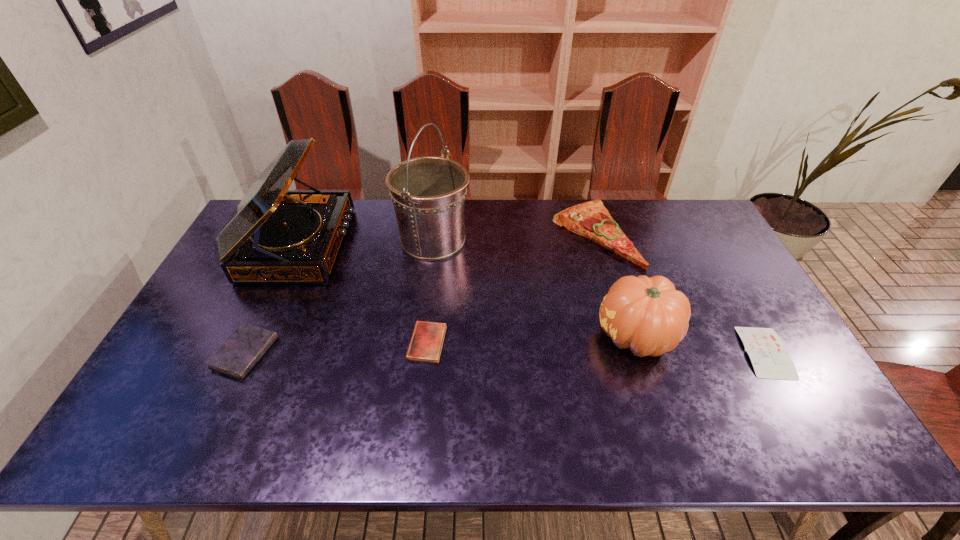
Where is `blank space at the far right corner of the desktop`? blank space at the far right corner of the desktop is located at coordinates (681, 219).

The image size is (960, 540). In order to click on free spot between the third shortest object and the pizza in this screenshot , I will do `click(420, 293)`.

You are a GUI agent. You are given a task and a screenshot of the screen. Output one action in this format:
    pyautogui.click(x=<x>, y=<y>)
    Task: Click on the vacant region between the pumpkin and the sixth tallest object
    
    Given the screenshot: What is the action you would take?
    pyautogui.click(x=532, y=339)

The image size is (960, 540). What are the coordinates of `vacant region between the tallest diary and the rightmost diary` in the screenshot? It's located at (505, 353).

You are a GUI agent. You are given a task and a screenshot of the screen. Output one action in this format:
    pyautogui.click(x=<x>, y=<y>)
    Task: Click on the empty location between the pizza and the sixth tallest object
    The height and width of the screenshot is (540, 960).
    Given the screenshot: What is the action you would take?
    [x=511, y=288]

This screenshot has height=540, width=960. What are the coordinates of `free space between the shortest diary and the fifth shortest object` in the screenshot? It's located at (701, 344).

Image resolution: width=960 pixels, height=540 pixels. Identify the location of free space between the shortest object and the second tallest object. (532, 299).

Identify the location of empty space that is in between the shortest diary and the bucket. This screenshot has width=960, height=540. (599, 296).

The image size is (960, 540). Find the location of `the sixth closest object to the sixth shortest object`. the sixth closest object to the sixth shortest object is located at coordinates (768, 355).

What are the coordinates of `object that ranks as the third closest to the shortest object` in the screenshot? It's located at (428, 193).